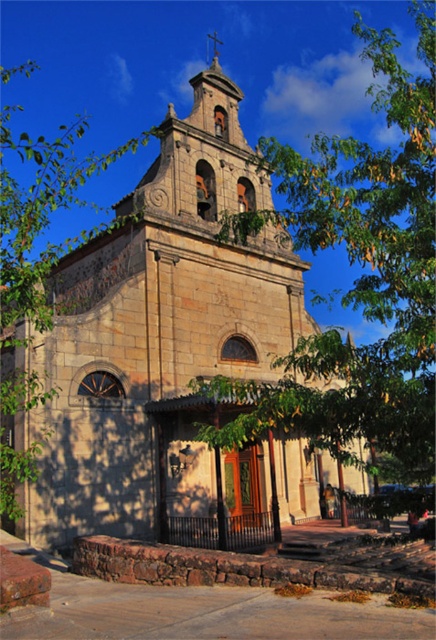
From the picture: You are standing in front of the stone church at center and want to take a photo of the green leafy tree at left. Which direction should you turn to face the tree?

Since the stone church at center is positioned on the right side of green leafy tree at left, you should turn to your left to face the green leafy tree at left.

You are standing in front of the stone church at center and want to take a photo of it. There is a green leafy tree at left nearby. To avoid the tree blocking the church in the photo, should you move to the left or right side of the tree?

The stone church at center is located below green leafy tree at left, so moving to the right side of the green leafy tree at left would ensure the tree does not block the church in your photo.

You are standing in front of the stone church at center and looking up. There is a green leafy tree at center above you. Can you see the tree from your current position? Please explain why.

Yes, you can see the green leafy tree at center because the stone church at center is below it, so the tree is positioned above the church in your line of sight.